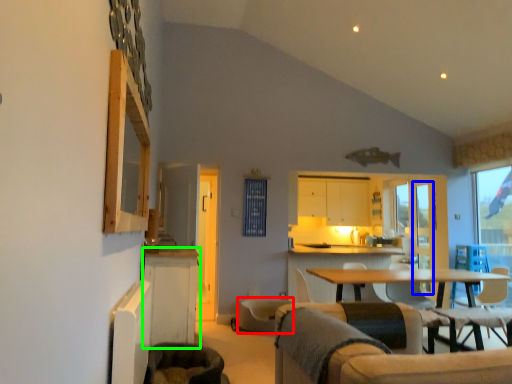
Question: Based on their relative distances, which object is farther from swivel chair (highlighted by a red box)? Choose from screen door (highlighted by a blue box) and cabinetry (highlighted by a green box).

Choices:
 (A) screen door
 (B) cabinetry

Answer: (A)